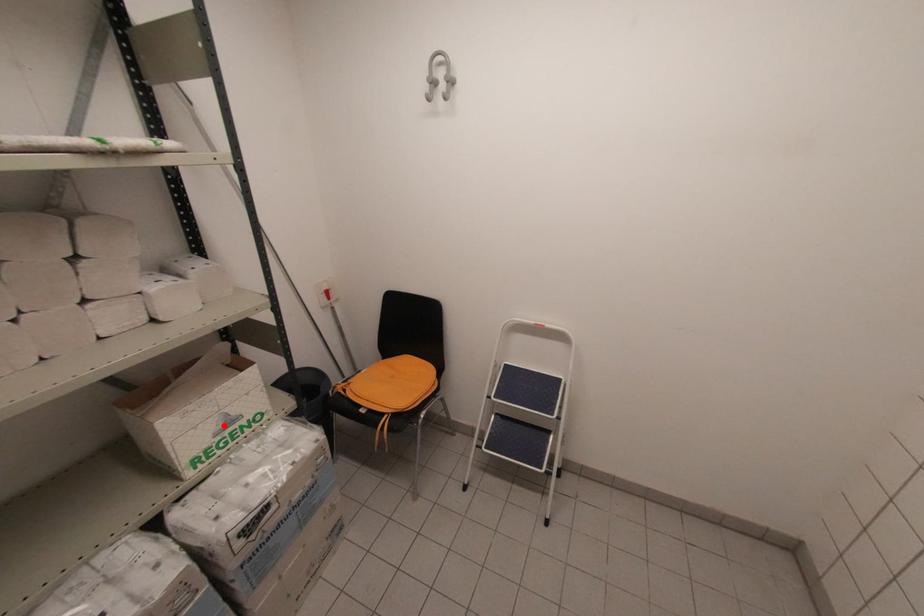
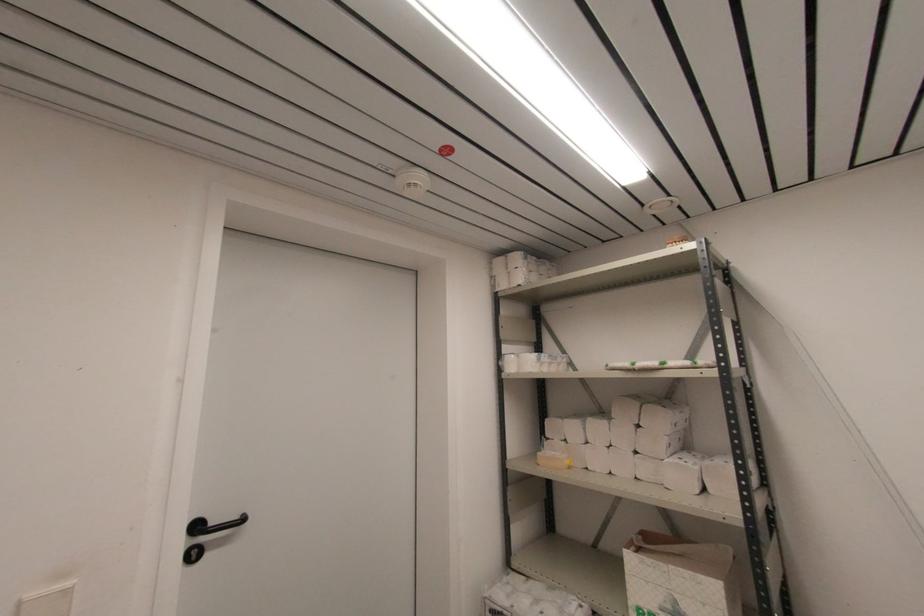
Find the pixel in the second image that matches the highlighted location in the first image.

(671, 609)